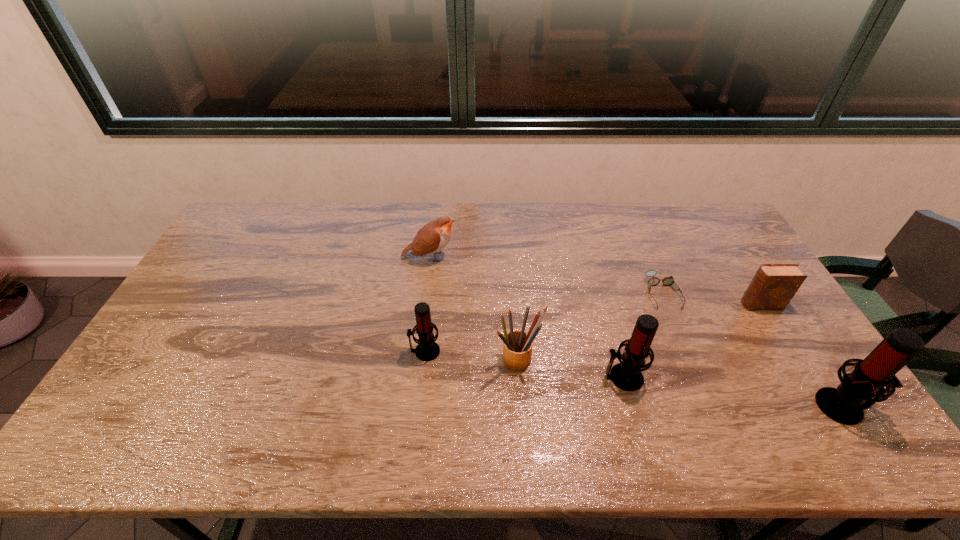
Where is `free space between the third object from right to left and the third object from left to right`? free space between the third object from right to left and the third object from left to right is located at coordinates (590, 326).

Identify the location of free space between the farthest object and the shortest object. (546, 275).

Locate an element on the screen. The height and width of the screenshot is (540, 960). free space between the tallest microphone and the third object from right to left is located at coordinates (753, 349).

Where is `free space that is in between the pencil box and the bird`? The image size is (960, 540). free space that is in between the pencil box and the bird is located at coordinates (474, 308).

Locate an element on the screen. The image size is (960, 540). free space between the farthest microphone and the third object from left to right is located at coordinates (471, 355).

Where is `vacant point located between the shortest microphone and the fifth object from right to left`? The height and width of the screenshot is (540, 960). vacant point located between the shortest microphone and the fifth object from right to left is located at coordinates (471, 355).

The width and height of the screenshot is (960, 540). I want to click on free space that is in between the fifth object from right to left and the second shortest microphone, so click(x=570, y=368).

Identify which object is located as the sixth nearest to the spectacles. Please provide its 2D coordinates. Your answer should be formatted as a tuple, i.e. [(x, y)], where the tuple contains the x and y coordinates of a point satisfying the conditions above.

[(427, 349)]

Identify which object is the nearest to the rightmost microphone. Please provide its 2D coordinates. Your answer should be formatted as a tuple, i.e. [(x, y)], where the tuple contains the x and y coordinates of a point satisfying the conditions above.

[(774, 285)]

Locate which microphone ranks in proximity to the fourth object from right to left. Please provide its 2D coordinates. Your answer should be formatted as a tuple, i.e. [(x, y)], where the tuple contains the x and y coordinates of a point satisfying the conditions above.

[(863, 387)]